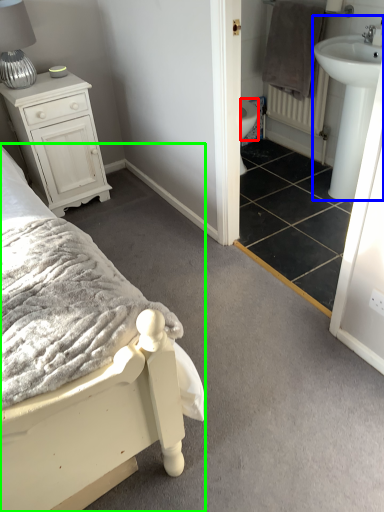
Question: Considering the real-world distances, which object is farthest from bidet (highlighted by a red box)? sink (highlighted by a blue box) or bed (highlighted by a green box)?

Choices:
 (A) sink
 (B) bed

Answer: (B)